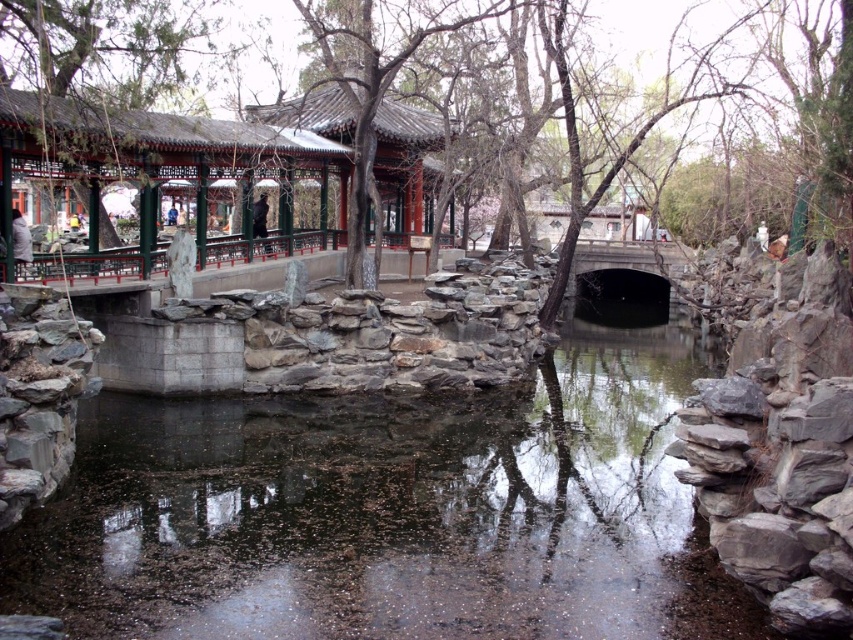
Question: Which point is farther to the camera?

Choices:
 (A) smooth bark tree at center
 (B) transparent water at center

Answer: (A)

Question: Which object is positioned closest to the matte red wood pavilion at upper left?

Choices:
 (A) smooth bark tree at center
 (B) transparent water at center

Answer: (A)

Question: Estimate the real-world distances between objects in this image. Which object is farther from the transparent water at center?

Choices:
 (A) smooth bark tree at center
 (B) matte red wood pavilion at upper left

Answer: (A)

Question: Can you confirm if matte red wood pavilion at upper left is thinner than smooth bark tree at center?

Choices:
 (A) no
 (B) yes

Answer: (B)

Question: Can you confirm if transparent water at center is positioned to the right of smooth bark tree at center?

Choices:
 (A) yes
 (B) no

Answer: (B)

Question: Can you confirm if transparent water at center is positioned above matte red wood pavilion at upper left?

Choices:
 (A) yes
 (B) no

Answer: (B)